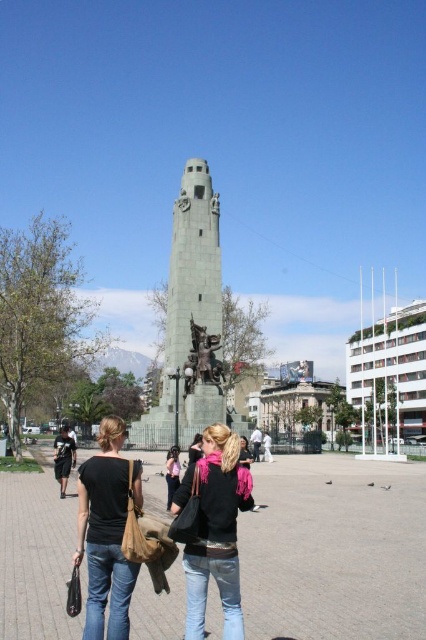
Question: Is black leather jacket at center to the right of pink fabric scarf at center from the viewer's perspective?

Choices:
 (A) yes
 (B) no

Answer: (B)

Question: Estimate the real-world distances between objects in this image. Which object is closer to the black leather jacket at center?

Choices:
 (A) black matte shirt at center
 (B) matte black jacket at center

Answer: (A)

Question: Does pink fabric scarf at center appear over matte black hair at center?

Choices:
 (A) no
 (B) yes

Answer: (B)

Question: Does bronze statue at center have a smaller size compared to pink fabric scarf at center?

Choices:
 (A) yes
 (B) no

Answer: (A)

Question: Which object appears farthest from the camera in this image?

Choices:
 (A) black leather jacket at center
 (B) black matte shirt at center

Answer: (A)

Question: Which point is farther to the camera?

Choices:
 (A) (175, 538)
 (B) (172, 452)

Answer: (B)